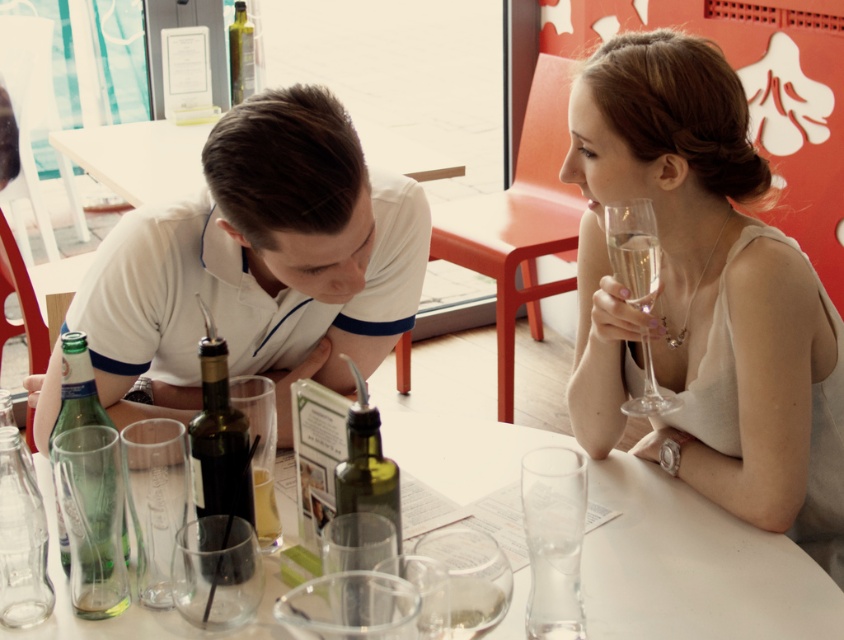
You are a photographer who needs to take a photo of the white satin dress at upper right. The camera you are holding is 1.11 meters away from the dress. Is the distance sufficient to capture the entire dress in the frame?

The white satin dress at upper right and the camera are 1.11 meters apart. Whether this distance is sufficient depends on the camera lens used. A standard lens might require closer proximity, while a wide angle lens could capture the entire dress from that distance. Without specific lens details, it is difficult to determine definitively.

In the scene shown: You are a waiter at the table. You need to place a dessert menu between the white satin dress at upper right and the translucent glass at table center. Can you fit it there?

The distance between the white satin dress at upper right and the translucent glass at table center is 74.00 centimeters, so yes, the dessert menu can be placed between them as there is sufficient space.